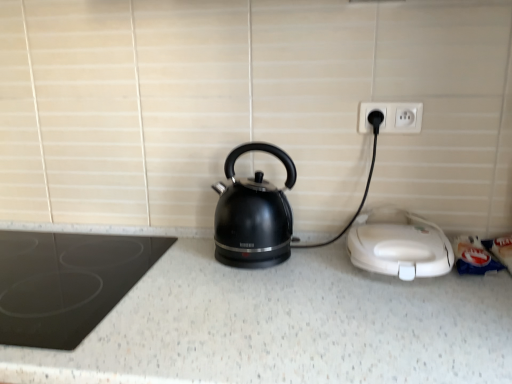
Consider the image. How much space does black glass cooktop at left, placed as the first home appliance when sorted from left to right, occupy horizontally?

54.94 centimeters.

Identify the location of white plastic outlet at upper right. (392, 117).

This screenshot has height=384, width=512. What do you see at coordinates (400, 246) in the screenshot?
I see `white plastic sandwich maker at lower right, placed as the second home appliance when sorted from left to right` at bounding box center [400, 246].

In the scene shown: Measure the distance between point (245, 225) and camera.

They are 37.83 inches apart.

Measure the distance between white speckled granite at center and camera.

white speckled granite at center and camera are 24.09 inches apart from each other.

The image size is (512, 384). I want to click on white speckled granite at center, so click(x=281, y=323).

At what (x,y) coordinates should I click in order to perform the action: click on black glass cooktop at left, placed as the first home appliance when sorted from left to right. Please return your answer as a coordinate pair (x, y). The height and width of the screenshot is (384, 512). Looking at the image, I should click on (66, 283).

Is black glass cooktop at left, placed as the second home appliance when sorted from right to left, next to white plastic sandwich maker at lower right, placed as the second home appliance when sorted from left to right, and touching it?

No, black glass cooktop at left, placed as the second home appliance when sorted from right to left, is not touching white plastic sandwich maker at lower right, placed as the second home appliance when sorted from left to right.

Locate an element on the screen. The image size is (512, 384). home appliance located below the white plastic sandwich maker at lower right, which is the first home appliance in right-to-left order (from the image's perspective) is located at coordinates (66, 283).

Is the position of black glass cooktop at left, placed as the first home appliance when sorted from left to right, less distant than that of white plastic sandwich maker at lower right, which is the first home appliance in right-to-left order?

Yes.

Does black glass cooktop at left, placed as the second home appliance when sorted from right to left, have a smaller size compared to white plastic sandwich maker at lower right, placed as the second home appliance when sorted from left to right?

No.

Does black glossy kettle at center have a lesser width compared to white speckled granite at center?

Correct, the width of black glossy kettle at center is less than that of white speckled granite at center.

Is black glossy kettle at center not near white speckled granite at center?

black glossy kettle at center is near white speckled granite at center, not far away.

Considering the sizes of objects black glossy kettle at center and white speckled granite at center in the image provided, who is shorter, black glossy kettle at center or white speckled granite at center?

Standing shorter between the two is black glossy kettle at center.

Does white speckled granite at center have a lesser height compared to black glass cooktop at left, placed as the second home appliance when sorted from right to left?

In fact, white speckled granite at center may be taller than black glass cooktop at left, placed as the second home appliance when sorted from right to left.

In the scene shown: Considering the relative sizes of white speckled granite at center and black glass cooktop at left, placed as the second home appliance when sorted from right to left, in the image provided, is white speckled granite at center thinner than black glass cooktop at left, placed as the second home appliance when sorted from right to left,?

Incorrect, the width of white speckled granite at center is not less than that of black glass cooktop at left, placed as the second home appliance when sorted from right to left.

Is the surface of white speckled granite at center in direct contact with black glass cooktop at left, placed as the second home appliance when sorted from right to left?

No, white speckled granite at center is not touching black glass cooktop at left, placed as the second home appliance when sorted from right to left.

From the image's perspective, is white speckled granite at center above or below black glossy kettle at center?

white speckled granite at center is situated lower than black glossy kettle at center in the image.

From a real-world perspective, is white speckled granite at center positioned under black glossy kettle at center based on gravity?

Indeed, from a real-world perspective, white speckled granite at center is positioned beneath black glossy kettle at center.

Can you confirm if white speckled granite at center is wider than black glossy kettle at center?

Yes, white speckled granite at center is wider than black glossy kettle at center.

Is white speckled granite at center oriented away from white plastic outlet at upper right?

No, white speckled granite at center is not facing the opposite direction of white plastic outlet at upper right.

Is white speckled granite at center positioned before white plastic outlet at upper right?

That is True.

Is white speckled granite at center positioned far away from white plastic outlet at upper right?

Actually, white speckled granite at center and white plastic outlet at upper right are a little close together.

From a real-world perspective, is white speckled granite at center above or below white plastic outlet at upper right?

In terms of real-world spatial position, white speckled granite at center is below white plastic outlet at upper right.

Is white plastic sandwich maker at lower right, placed as the second home appliance when sorted from left to right, positioned before black glossy kettle at center?

Yes, white plastic sandwich maker at lower right, placed as the second home appliance when sorted from left to right, is closer to the camera.

Considering the sizes of objects white plastic sandwich maker at lower right, which is the first home appliance in right-to-left order, and black glossy kettle at center in the image provided, who is taller, white plastic sandwich maker at lower right, which is the first home appliance in right-to-left order, or black glossy kettle at center?

black glossy kettle at center is taller.

Considering the sizes of objects white plastic sandwich maker at lower right, which is the first home appliance in right-to-left order, and black glossy kettle at center in the image provided, who is smaller, white plastic sandwich maker at lower right, which is the first home appliance in right-to-left order, or black glossy kettle at center?

white plastic sandwich maker at lower right, which is the first home appliance in right-to-left order, is smaller.

Considering the points (415, 347) and (366, 263), which point is in front, point (415, 347) or point (366, 263)?

Positioned in front is point (415, 347).

Between white speckled granite at center and white plastic sandwich maker at lower right, which is the first home appliance in right-to-left order, which one is positioned in front?

Positioned in front is white speckled granite at center.

Choose the correct answer: Is white speckled granite at center inside white plastic sandwich maker at lower right, placed as the second home appliance when sorted from left to right, or outside it?

white speckled granite at center cannot be found inside white plastic sandwich maker at lower right, placed as the second home appliance when sorted from left to right.

Considering the sizes of objects white speckled granite at center and white plastic sandwich maker at lower right, placed as the second home appliance when sorted from left to right, in the image provided, who is wider, white speckled granite at center or white plastic sandwich maker at lower right, placed as the second home appliance when sorted from left to right,?

white speckled granite at center.

This screenshot has height=384, width=512. Identify the location of home appliance that is above the black glass cooktop at left, placed as the first home appliance when sorted from left to right (from the image's perspective). (400, 246).

Identify the location of counter top below the black glossy kettle at center (from a real-world perspective). (281, 323).

In the scene shown: Based on their spatial positions, is white speckled granite at center or white plastic outlet at upper right further from black glass cooktop at left, placed as the first home appliance when sorted from left to right?

The object further to black glass cooktop at left, placed as the first home appliance when sorted from left to right, is white plastic outlet at upper right.

Based on their spatial positions, is white plastic sandwich maker at lower right, placed as the second home appliance when sorted from left to right, or black glass cooktop at left, placed as the second home appliance when sorted from right to left, closer to white speckled granite at center?

Among the two, white plastic sandwich maker at lower right, placed as the second home appliance when sorted from left to right, is located nearer to white speckled granite at center.

Based on their spatial positions, is white plastic outlet at upper right or black glossy kettle at center further from black glass cooktop at left, placed as the second home appliance when sorted from right to left?

white plastic outlet at upper right is further to black glass cooktop at left, placed as the second home appliance when sorted from right to left.

Estimate the real-world distances between objects in this image. Which object is closer to black glass cooktop at left, placed as the first home appliance when sorted from left to right, white speckled granite at center or white plastic sandwich maker at lower right, which is the first home appliance in right-to-left order?

white speckled granite at center lies closer to black glass cooktop at left, placed as the first home appliance when sorted from left to right, than the other object.

Estimate the real-world distances between objects in this image. Which object is closer to black glass cooktop at left, placed as the first home appliance when sorted from left to right, white plastic sandwich maker at lower right, placed as the second home appliance when sorted from left to right, or black glossy kettle at center?

black glossy kettle at center.

Looking at this image, looking at the image, which one is located further to black glass cooktop at left, placed as the second home appliance when sorted from right to left, white plastic sandwich maker at lower right, placed as the second home appliance when sorted from left to right, or white plastic outlet at upper right?

white plastic outlet at upper right lies further to black glass cooktop at left, placed as the second home appliance when sorted from right to left, than the other object.

Considering their positions, is black glossy kettle at center positioned closer to white plastic sandwich maker at lower right, which is the first home appliance in right-to-left order, than white plastic outlet at upper right?

black glossy kettle at center.

Considering their positions, is white plastic outlet at upper right positioned closer to white plastic sandwich maker at lower right, which is the first home appliance in right-to-left order, than black glass cooktop at left, placed as the second home appliance when sorted from right to left?

Based on the image, white plastic outlet at upper right appears to be nearer to white plastic sandwich maker at lower right, which is the first home appliance in right-to-left order.

Identify the location of counter top between black glass cooktop at left, placed as the second home appliance when sorted from right to left, and white plastic sandwich maker at lower right, placed as the second home appliance when sorted from left to right, in the horizontal direction. (281, 323).

Where is `kitchen appliance located between black glass cooktop at left, placed as the second home appliance when sorted from right to left, and white plastic outlet at upper right in the left-right direction`? kitchen appliance located between black glass cooktop at left, placed as the second home appliance when sorted from right to left, and white plastic outlet at upper right in the left-right direction is located at coordinates (253, 214).

Where is `kitchen appliance that lies between white plastic outlet at upper right and white speckled granite at center from top to bottom`? The height and width of the screenshot is (384, 512). kitchen appliance that lies between white plastic outlet at upper right and white speckled granite at center from top to bottom is located at coordinates (253, 214).

You are a GUI agent. You are given a task and a screenshot of the screen. Output one action in this format:
    pyautogui.click(x=<x>, y=<y>)
    Task: Click on the electric outlet between black glossy kettle at center and white plastic sandwich maker at lower right, placed as the second home appliance when sorted from left to right, in the horizontal direction
    The width and height of the screenshot is (512, 384).
    Given the screenshot: What is the action you would take?
    pyautogui.click(x=392, y=117)